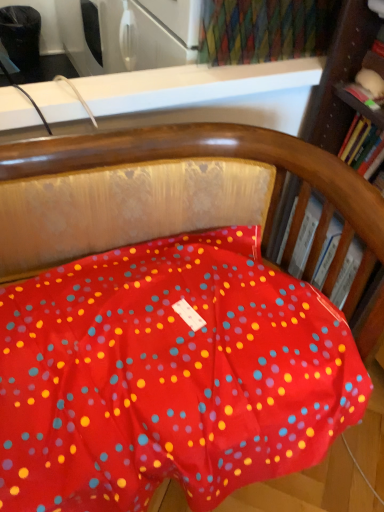
Question: From a real-world perspective, is hardcover book at right, the 1th book positioned from the bottom, beneath hardcover book at right, acting as the 2th book starting from the bottom?

Choices:
 (A) no
 (B) yes

Answer: (B)

Question: Considering the relative sizes of hardcover book at right, the 1th book positioned from the bottom, and hardcover book at right, positioned as the first book in top-to-bottom order, in the image provided, is hardcover book at right, the 1th book positioned from the bottom, wider than hardcover book at right, positioned as the first book in top-to-bottom order,?

Choices:
 (A) yes
 (B) no

Answer: (A)

Question: From the image's perspective, is hardcover book at right, the 1th book positioned from the bottom, on top of hardcover book at right, positioned as the first book in top-to-bottom order?

Choices:
 (A) yes
 (B) no

Answer: (B)

Question: Considering the relative sizes of hardcover book at right, arranged as the 2th book when viewed from the top, and hardcover book at right, positioned as the first book in top-to-bottom order, in the image provided, is hardcover book at right, arranged as the 2th book when viewed from the top, smaller than hardcover book at right, positioned as the first book in top-to-bottom order,?

Choices:
 (A) yes
 (B) no

Answer: (B)

Question: From the image's perspective, would you say hardcover book at right, the 1th book positioned from the bottom, is shown under hardcover book at right, acting as the 2th book starting from the bottom?

Choices:
 (A) yes
 (B) no

Answer: (A)

Question: Does hardcover book at right, the 1th book positioned from the bottom, contain hardcover book at right, positioned as the first book in top-to-bottom order?

Choices:
 (A) yes
 (B) no

Answer: (B)

Question: Considering the relative sizes of hardcover book at right, positioned as the first book in top-to-bottom order, and hardcover book at right, the 1th book positioned from the bottom, in the image provided, is hardcover book at right, positioned as the first book in top-to-bottom order, taller than hardcover book at right, the 1th book positioned from the bottom,?

Choices:
 (A) yes
 (B) no

Answer: (B)

Question: Considering the relative sizes of hardcover book at right, acting as the 2th book starting from the bottom, and hardcover book at right, arranged as the 2th book when viewed from the top, in the image provided, is hardcover book at right, acting as the 2th book starting from the bottom, shorter than hardcover book at right, arranged as the 2th book when viewed from the top,?

Choices:
 (A) yes
 (B) no

Answer: (A)

Question: Is hardcover book at right, positioned as the first book in top-to-bottom order, next to hardcover book at right, the 1th book positioned from the bottom, and touching it?

Choices:
 (A) no
 (B) yes

Answer: (A)

Question: Is hardcover book at right, positioned as the first book in top-to-bottom order, to the right of hardcover book at right, the 1th book positioned from the bottom, from the viewer's perspective?

Choices:
 (A) yes
 (B) no

Answer: (A)

Question: Is hardcover book at right, positioned as the first book in top-to-bottom order, facing away from hardcover book at right, arranged as the 2th book when viewed from the top?

Choices:
 (A) no
 (B) yes

Answer: (A)

Question: Is the depth of hardcover book at right, positioned as the first book in top-to-bottom order, greater than that of hardcover book at right, the 1th book positioned from the bottom?

Choices:
 (A) yes
 (B) no

Answer: (B)

Question: From a real-world perspective, is hardcover book at right, acting as the 2th book starting from the bottom, positioned above or below hardcover book at right, arranged as the 2th book when viewed from the top?

Choices:
 (A) below
 (B) above

Answer: (B)